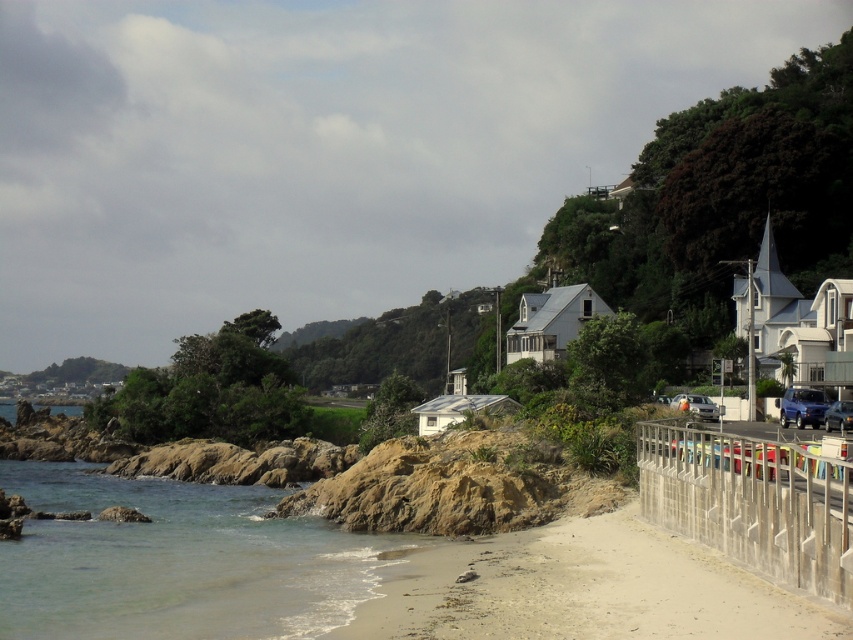
You are standing on the beach and see the gray concrete fence at lower right and the blue metallic car at lower right. Which object is higher up from the beach?

The gray concrete fence at lower right is above the blue metallic car at lower right, so the gray concrete fence at lower right is higher up from the beach.

You are standing at the beach and see two points marked on the image. The first point is at coordinates point [527,531] and the second point is at point [827,560]. Which point is closer to you?

Point [827,560] is closer to you because it is in front of point [527,531].

You are a beachcomber searching for treasures on the light beige sand at lower center and the gray concrete fence at lower right. Which area would you prioritize if you want to cover a larger area quickly?

The light beige sand at lower center is larger in size than the gray concrete fence at lower right, so you should prioritize the light beige sand at lower center to cover a larger area quickly.